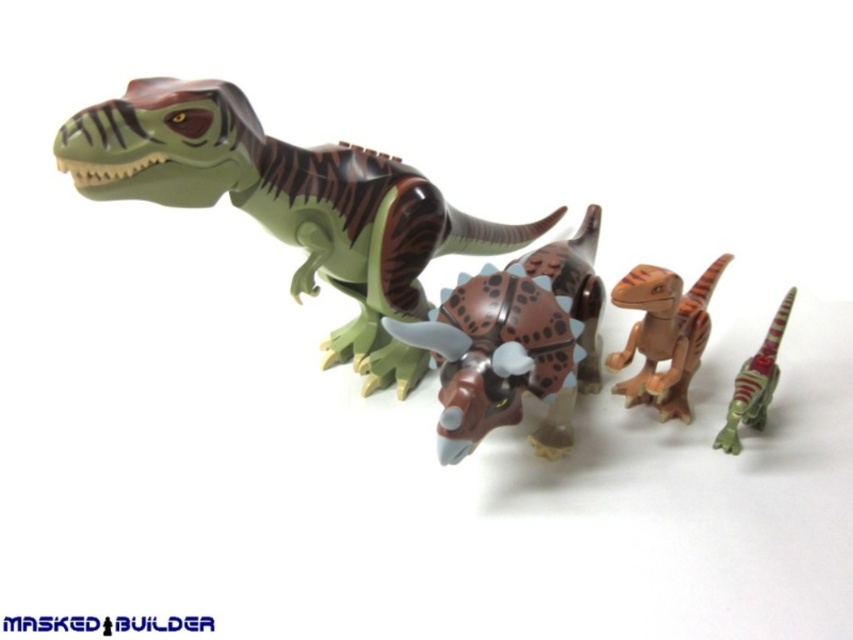
Question: Based on their relative distances, which object is farther from the brown matte triceratops at center?

Choices:
 (A) brown matte/studded triceratops at center
 (B) brown matte dinosaur at center
 (C) shiny green plastic dinosaur at lower right
 (D) green matte tyrannosaurus rex at upper left

Answer: (D)

Question: Among these objects, which one is farthest from the camera?

Choices:
 (A) brown matte/studded triceratops at center
 (B) green matte tyrannosaurus rex at upper left
 (C) shiny green plastic dinosaur at lower right

Answer: (C)

Question: Is brown matte dinosaur at center positioned before shiny green plastic dinosaur at lower right?

Choices:
 (A) no
 (B) yes

Answer: (B)

Question: Which object is farther from the camera taking this photo?

Choices:
 (A) brown matte triceratops at center
 (B) shiny green plastic dinosaur at lower right
 (C) green matte tyrannosaurus rex at upper left

Answer: (A)

Question: Is green matte tyrannosaurus rex at upper left below brown matte/studded triceratops at center?

Choices:
 (A) yes
 (B) no

Answer: (B)

Question: From the image, what is the correct spatial relationship of brown matte/studded triceratops at center in relation to shiny green plastic dinosaur at lower right?

Choices:
 (A) above
 (B) below

Answer: (A)